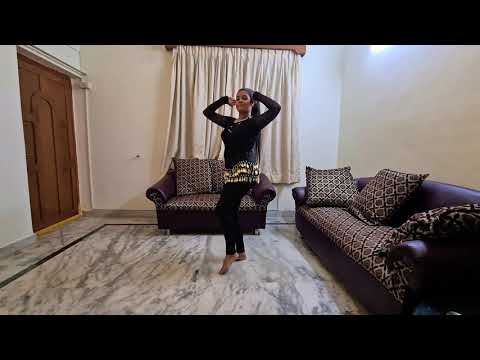
Identify the location of cushion. (187, 175), (218, 174), (327, 187), (388, 189), (436, 226).